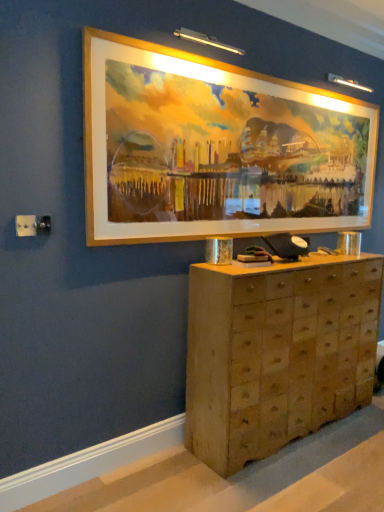
What do you see at coordinates (216, 148) in the screenshot?
I see `gold-framed painting at upper center` at bounding box center [216, 148].

Image resolution: width=384 pixels, height=512 pixels. I want to click on gold-framed painting at upper center, so click(216, 148).

Identify the location of wooden chest of drawers at center. (277, 352).

What do you see at coordinates (277, 352) in the screenshot?
I see `wooden chest of drawers at center` at bounding box center [277, 352].

At what (x,y) coordinates should I click in order to perform the action: click on gold-framed painting at upper center. Please return your answer as a coordinate pair (x, y). Image resolution: width=384 pixels, height=512 pixels. Looking at the image, I should click on (216, 148).

Which object is positioned more to the right, gold-framed painting at upper center or wooden chest of drawers at center?

wooden chest of drawers at center is more to the right.

Is gold-framed painting at upper center positioned behind wooden chest of drawers at center?

No, the depth of gold-framed painting at upper center is less than that of wooden chest of drawers at center.

Is point (198, 182) farther from viewer compared to point (223, 440)?

Yes, point (198, 182) is behind point (223, 440).

From the image's perspective, is gold-framed painting at upper center positioned above or below wooden chest of drawers at center?

Clearly, from the image's perspective, gold-framed painting at upper center is above wooden chest of drawers at center.

From a real-world perspective, is gold-framed painting at upper center over wooden chest of drawers at center?

Yes.

Based on the photo, between gold-framed painting at upper center and wooden chest of drawers at center, which one has larger width?

Wider between the two is wooden chest of drawers at center.

Considering the relative sizes of gold-framed painting at upper center and wooden chest of drawers at center in the image provided, is gold-framed painting at upper center taller than wooden chest of drawers at center?

In fact, gold-framed painting at upper center may be shorter than wooden chest of drawers at center.

Considering the sizes of objects gold-framed painting at upper center and wooden chest of drawers at center in the image provided, who is bigger, gold-framed painting at upper center or wooden chest of drawers at center?

wooden chest of drawers at center.

Is gold-framed painting at upper center not within wooden chest of drawers at center?

Absolutely, gold-framed painting at upper center is external to wooden chest of drawers at center.

Is gold-framed painting at upper center not near wooden chest of drawers at center?

No.

Is gold-framed painting at upper center facing away from wooden chest of drawers at center?

That's not correct — gold-framed painting at upper center is not looking away from wooden chest of drawers at center.

What's the angular difference between gold-framed painting at upper center and wooden chest of drawers at center's facing directions?

There is a 0.0339-degree angle between the facing directions of gold-framed painting at upper center and wooden chest of drawers at center.

In the image, there is a gold-framed painting at upper center. At what (x,y) coordinates should I click in order to perform the action: click on the chest of drawers below it (from the image's perspective). Please return your answer as a coordinate pair (x, y). The width and height of the screenshot is (384, 512). Looking at the image, I should click on (277, 352).

Which is more to the left, wooden chest of drawers at center or gold-framed painting at upper center?

gold-framed painting at upper center is more to the left.

In the image, is wooden chest of drawers at center positioned in front of or behind gold-framed painting at upper center?

wooden chest of drawers at center is behind gold-framed painting at upper center.

Does point (209, 340) come in front of point (282, 134)?

Yes, it is in front of point (282, 134).

From the image's perspective, does wooden chest of drawers at center appear lower than gold-framed painting at upper center?

Yes, from the image's perspective, wooden chest of drawers at center is below gold-framed painting at upper center.

From a real-world perspective, is wooden chest of drawers at center located beneath gold-framed painting at upper center?

Indeed, from a real-world perspective, wooden chest of drawers at center is positioned beneath gold-framed painting at upper center.

Can you confirm if wooden chest of drawers at center is wider than gold-framed painting at upper center?

Yes.

Considering the sizes of wooden chest of drawers at center and gold-framed painting at upper center in the image, is wooden chest of drawers at center taller or shorter than gold-framed painting at upper center?

Considering their sizes, wooden chest of drawers at center has more height than gold-framed painting at upper center.

In the scene shown: Considering the relative sizes of wooden chest of drawers at center and gold-framed painting at upper center in the image provided, is wooden chest of drawers at center bigger than gold-framed painting at upper center?

Yes, wooden chest of drawers at center is bigger than gold-framed painting at upper center.

Is wooden chest of drawers at center surrounding gold-framed painting at upper center?

No, gold-framed painting at upper center is not surrounded by wooden chest of drawers at center.

Is wooden chest of drawers at center next to gold-framed painting at upper center?

No, wooden chest of drawers at center is not with gold-framed painting at upper center.

Could you tell me if wooden chest of drawers at center is facing gold-framed painting at upper center?

No, wooden chest of drawers at center is not aimed at gold-framed painting at upper center.

How many degrees apart are the facing directions of wooden chest of drawers at center and gold-framed painting at upper center?

0.0339 degrees separate the facing orientations of wooden chest of drawers at center and gold-framed painting at upper center.

Where is `the chest of drawers directly beneath the gold-framed painting at upper center (from a real-world perspective)`? The width and height of the screenshot is (384, 512). the chest of drawers directly beneath the gold-framed painting at upper center (from a real-world perspective) is located at coordinates (277, 352).

Locate an element on the screen. This screenshot has width=384, height=512. the chest of drawers below the gold-framed painting at upper center (from a real-world perspective) is located at coordinates (277, 352).

Image resolution: width=384 pixels, height=512 pixels. I want to click on chest of drawers below the gold-framed painting at upper center (from the image's perspective), so click(x=277, y=352).